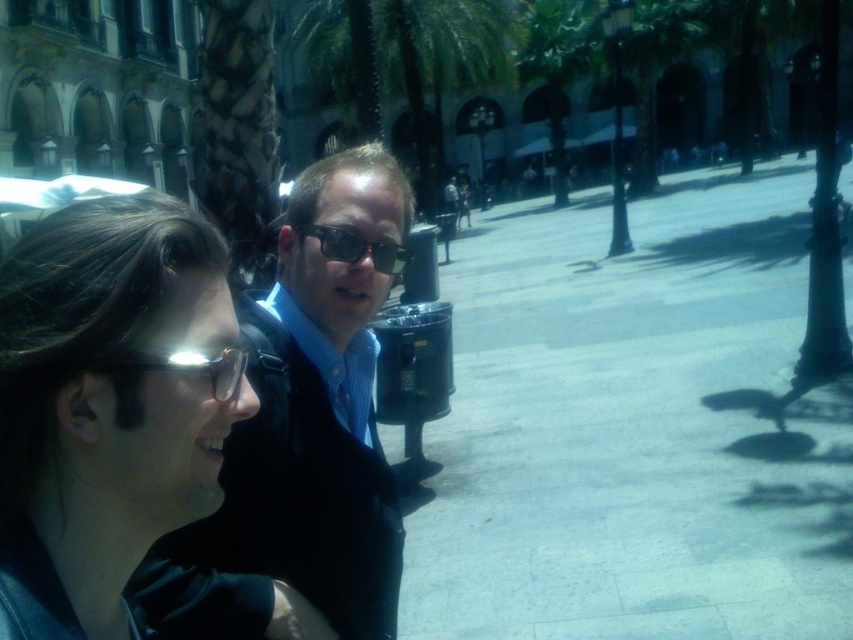
You are standing at the point with coordinates point (222, 612) and want to walk to the point with coordinates point (695, 330). Is the destination point in front of or behind you?

The destination point (695, 330) is behind point (222, 612), so the destination is behind you.

You are a photographer trying to capture both the matte black jacket at center and the green leafy palm tree at center in a single frame. Given their sizes, which object should you focus on first to ensure both are in the frame?

The matte black jacket at center has a smaller size compared to the green leafy palm tree at center. To ensure both are in the frame, focus on the smaller matte black jacket at center first, then adjust the camera angle to include the larger palm tree.